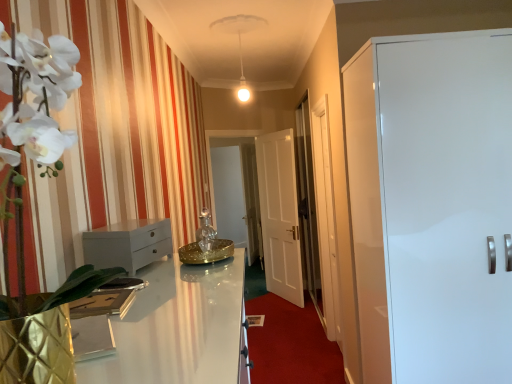
Question: Is white glossy door at center, the 1th door viewed from the back, shorter than white fabric curtain at left?

Choices:
 (A) no
 (B) yes

Answer: (A)

Question: From a real-world perspective, is white glossy door at center, the 2th door from the front, beneath white fabric curtain at left?

Choices:
 (A) no
 (B) yes

Answer: (B)

Question: Considering the relative sizes of white glossy door at center, the 2th door from the front, and white fabric curtain at left in the image provided, is white glossy door at center, the 2th door from the front, taller than white fabric curtain at left?

Choices:
 (A) yes
 (B) no

Answer: (A)

Question: Would you say white glossy door at center, the 2th door from the front, contains white fabric curtain at left?

Choices:
 (A) no
 (B) yes

Answer: (A)

Question: Is white glossy door at center, arranged as the second door when viewed from the right, positioned in front of white fabric curtain at left?

Choices:
 (A) yes
 (B) no

Answer: (B)

Question: From their relative heights in the image, would you say white glossy chest of drawers at left is taller or shorter than white glossy cabinet at right, the first door from the right?

Choices:
 (A) tall
 (B) short

Answer: (B)

Question: Would you say white glossy chest of drawers at left is to the left or to the right of white glossy cabinet at right, the first door from the right, in the picture?

Choices:
 (A) left
 (B) right

Answer: (A)

Question: Is white glossy chest of drawers at left spatially inside white glossy cabinet at right, placed as the second door when sorted from back to front, or outside of it?

Choices:
 (A) outside
 (B) inside

Answer: (A)

Question: From the image's perspective, is white glossy chest of drawers at left located above or below white glossy cabinet at right, the 2th door in the left-to-right sequence?

Choices:
 (A) above
 (B) below

Answer: (A)

Question: From the image's perspective, is transparent glass door at center, the 2th glass door when ordered from left to right, positioned above or below white glossy chest of drawers at left?

Choices:
 (A) below
 (B) above

Answer: (A)

Question: In terms of height, does transparent glass door at center, the 1th glass door positioned from the front, look taller or shorter compared to white glossy chest of drawers at left?

Choices:
 (A) tall
 (B) short

Answer: (A)

Question: Is transparent glass door at center, the 2th glass door when ordered from left to right, spatially inside white glossy chest of drawers at left, or outside of it?

Choices:
 (A) inside
 (B) outside

Answer: (B)

Question: In terms of size, does transparent glass door at center, the 2th glass door when ordered from left to right, appear bigger or smaller than white glossy chest of drawers at left?

Choices:
 (A) small
 (B) big

Answer: (B)

Question: Is white glossy cabinet at right, placed as the second door when sorted from back to front, in front of or behind white fabric curtain at left in the image?

Choices:
 (A) behind
 (B) front

Answer: (A)

Question: Is white glossy cabinet at right, the first door from the right, bigger or smaller than white fabric curtain at left?

Choices:
 (A) big
 (B) small

Answer: (A)